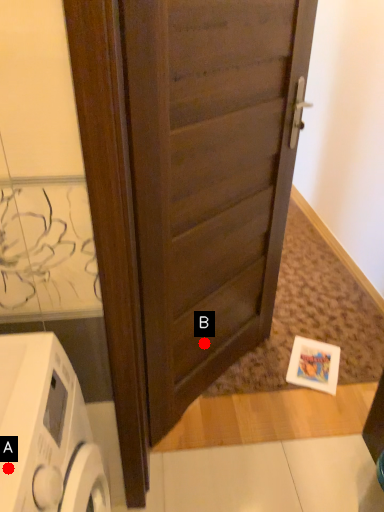
Question: Two points are circled on the image, labeled by A and B beside each circle. Which point is closer to the camera taking this photo?

Choices:
 (A) A is closer
 (B) B is closer

Answer: (A)